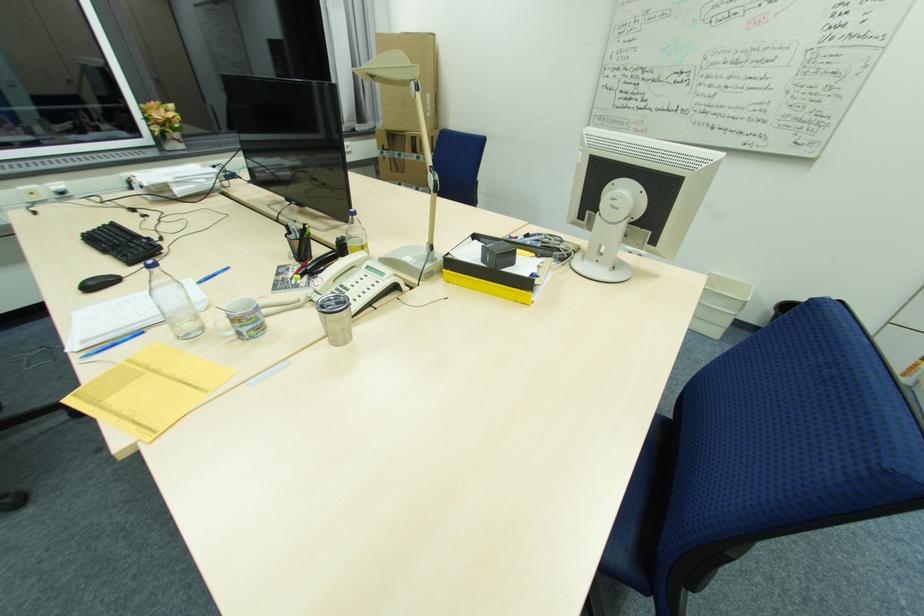
Find where to slid the black computer mouse. Please return your answer as a coordinate pair (x, y).

(99, 283)